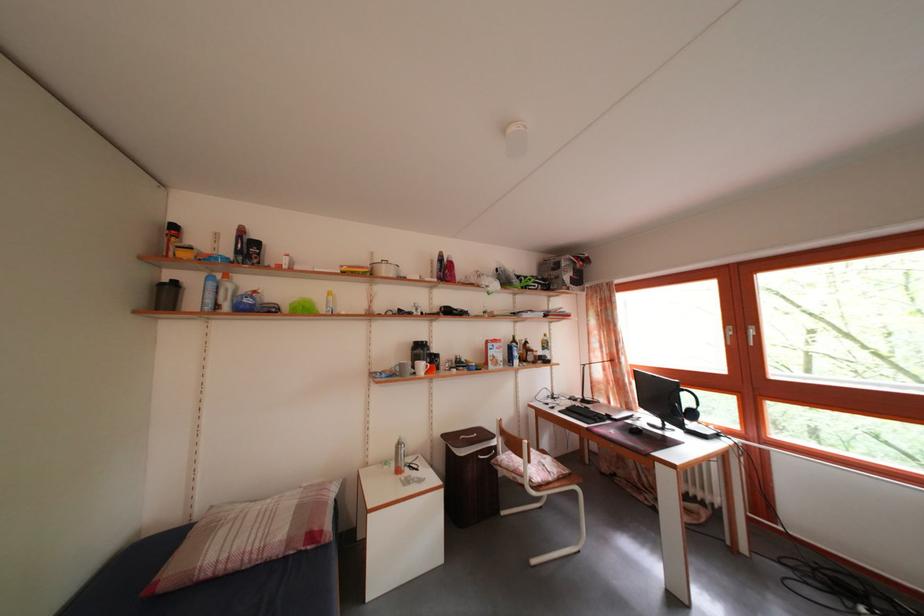
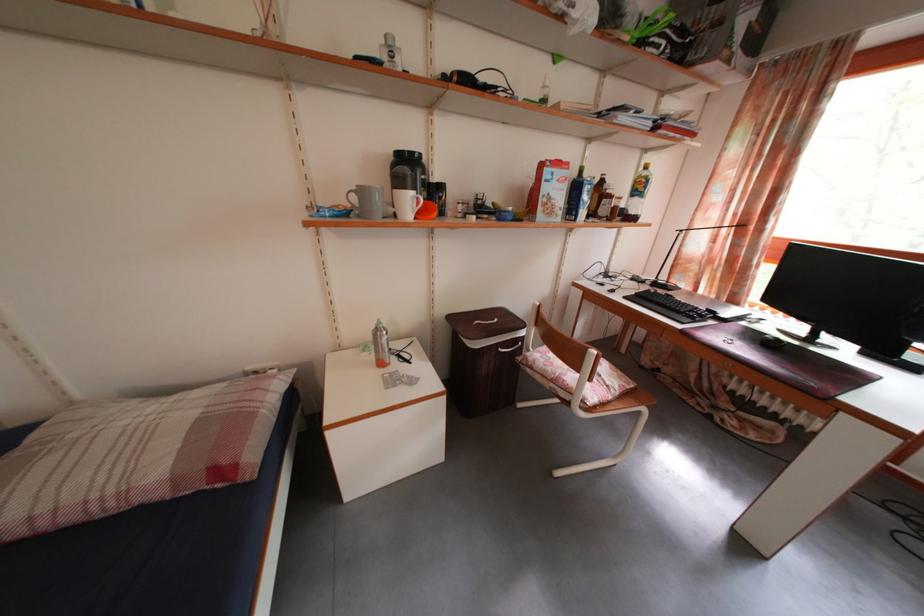
Find the pixel in the second image that matches (x=521, y=483) in the first image.

(560, 392)